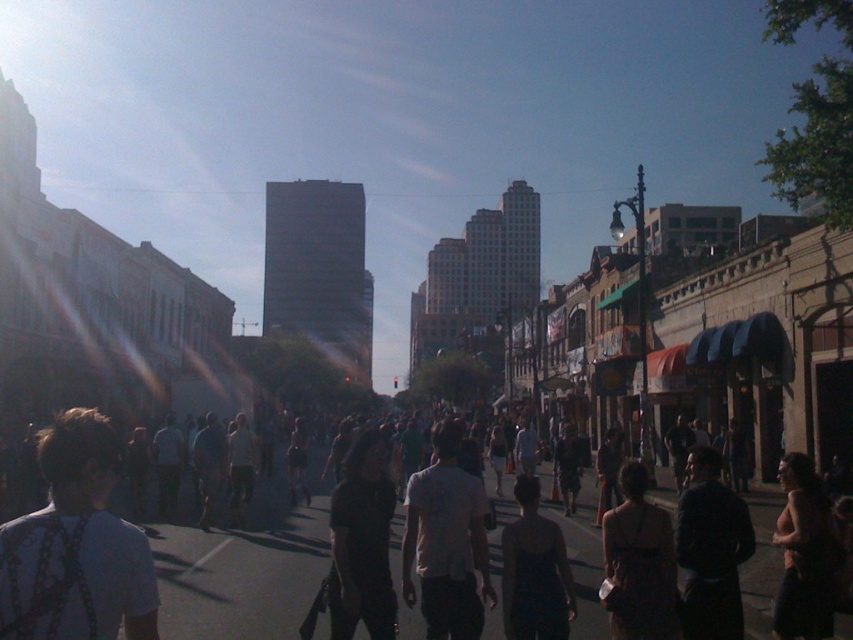
This screenshot has width=853, height=640. What do you see at coordinates (135, 561) in the screenshot?
I see `dark gray clothing at center` at bounding box center [135, 561].

Based on the photo, is dark gray clothing at center positioned behind dark gray shirt at center?

No, it is not.

Locate an element on the screen. This screenshot has width=853, height=640. dark gray clothing at center is located at coordinates (135, 561).

Who is more distant from viewer, (595, 563) or (131, 540)?

Positioned behind is point (595, 563).

The height and width of the screenshot is (640, 853). I want to click on dark gray clothing at center, so click(135, 561).

You are a GUI agent. You are given a task and a screenshot of the screen. Output one action in this format:
    pyautogui.click(x=<x>, y=<y>)
    Task: Click on the dark gray clothing at center
    
    Given the screenshot: What is the action you would take?
    [x=135, y=561]

Who is taller, white fabric bag at lower left or dark gray shirt at center?

white fabric bag at lower left is taller.

Based on the photo, is white fabric bag at lower left above dark gray shirt at center?

Indeed, white fabric bag at lower left is positioned over dark gray shirt at center.

Is point (106, 492) closer to viewer compared to point (560, 552)?

Yes, point (106, 492) is in front of point (560, 552).

Identify the location of white fabric bag at lower left. (76, 547).